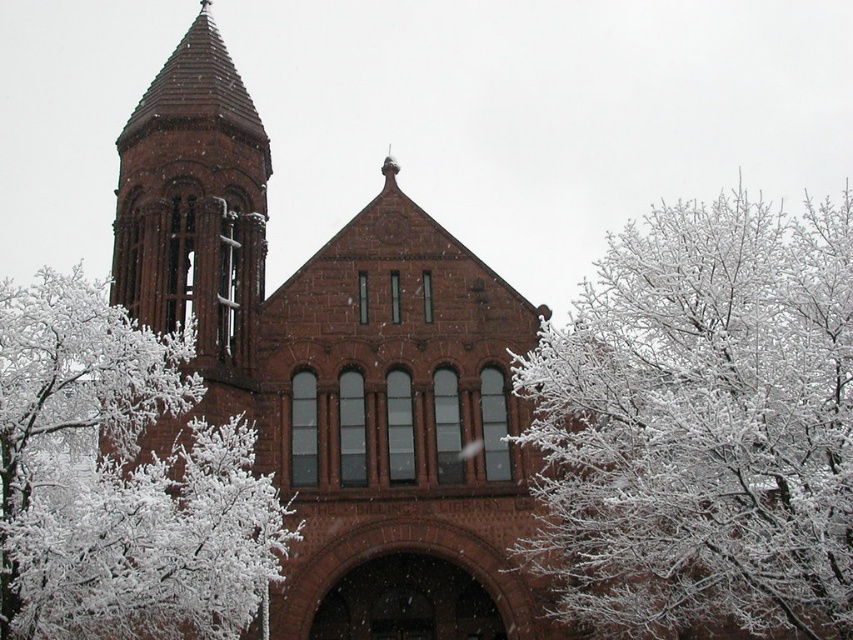
You are standing in front of the historic brick building and want to take a photo of the white frosty branches at upper right and the white frosty branches at center. Which branches are closer to you?

The white frosty branches at upper right are closer to you because the white frosty branches at center are behind them.

You are an architect analyzing the proportions of the building in the image. Which object, the white frosty branches at center or the matte brick tower at upper left, occupies more visual space in the scene?

The white frosty branches at center occupies more visual space than the matte brick tower at upper left because it is larger in size according to the description.